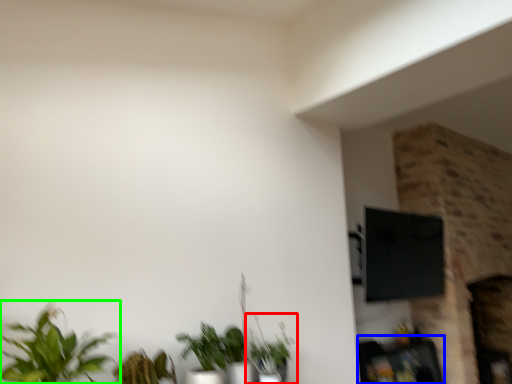
Question: Which is nearer to the houseplant (highlighted by a red box)? furniture (highlighted by a blue box) or houseplant (highlighted by a green box).

Choices:
 (A) furniture
 (B) houseplant

Answer: (B)